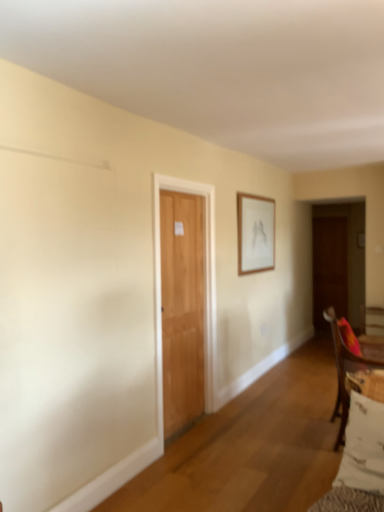
Question: Does point (347, 402) appear closer or farther from the camera than point (319, 288)?

Choices:
 (A) farther
 (B) closer

Answer: (B)

Question: Is wooden chair at lower right spatially inside brown wooden door at right, which ranks as the 2th door in left-to-right order, or outside of it?

Choices:
 (A) outside
 (B) inside

Answer: (A)

Question: Estimate the real-world distances between objects in this image. Which object is closer to the white cotton pillow at lower right?

Choices:
 (A) light brown wooden door at center, which is the second door from back to front
 (B) brown wooden door at right, which ranks as the 2th door in left-to-right order
 (C) wooden chair at lower right
 (D) wooden frame at upper center

Answer: (C)

Question: Based on their relative distances, which object is nearer to the wooden frame at upper center?

Choices:
 (A) brown wooden door at right, the second door viewed from the front
 (B) wooden chair at lower right
 (C) white cotton pillow at lower right
 (D) light brown wooden door at center, positioned as the 1th door in left-to-right order

Answer: (D)